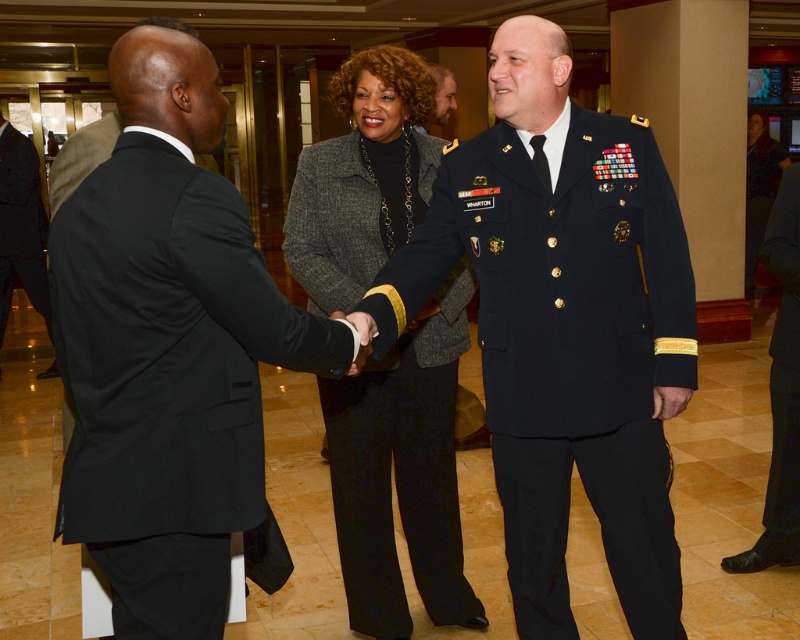
Question: Is black suit at left positioned behind light brown hair at center?

Choices:
 (A) no
 (B) yes

Answer: (A)

Question: Which of the following is the closest to the observer?

Choices:
 (A) (114, 493)
 (B) (454, 86)
 (C) (412, 125)
 (D) (652, 262)

Answer: (A)

Question: Is navy blue uniform at center closer to the viewer compared to gray woolen blazer at center?

Choices:
 (A) no
 (B) yes

Answer: (B)

Question: Which of these objects is positioned closest to the black suit at left?

Choices:
 (A) light brown hair at center
 (B) gray woolen blazer at center
 (C) black wool suit at left

Answer: (B)

Question: Based on their relative distances, which object is nearer to the black wool suit at left?

Choices:
 (A) light brown hair at center
 (B) black suit at left
 (C) navy blue uniform at center

Answer: (A)

Question: Does black wool suit at left appear over light brown hair at center?

Choices:
 (A) no
 (B) yes

Answer: (A)